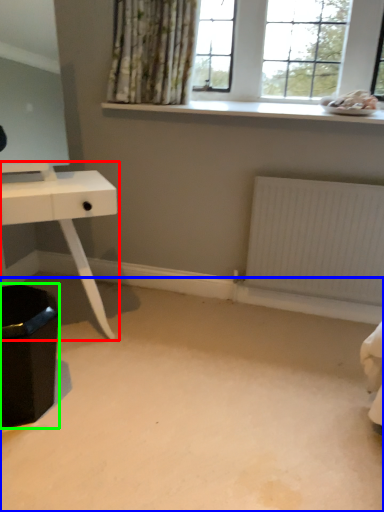
Question: Which object is positioned closest to table (highlighted by a red box)? Select from plain (highlighted by a blue box) and step stool (highlighted by a green box).

Choices:
 (A) plain
 (B) step stool

Answer: (B)